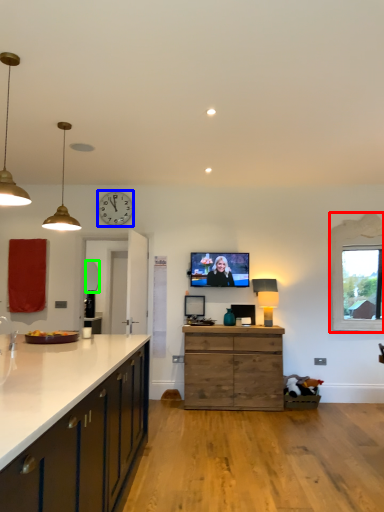
Question: Based on their relative distances, which object is nearer to window (highlighted by a red box)? Choose from clock (highlighted by a blue box) and mirror (highlighted by a green box).

Choices:
 (A) clock
 (B) mirror

Answer: (A)